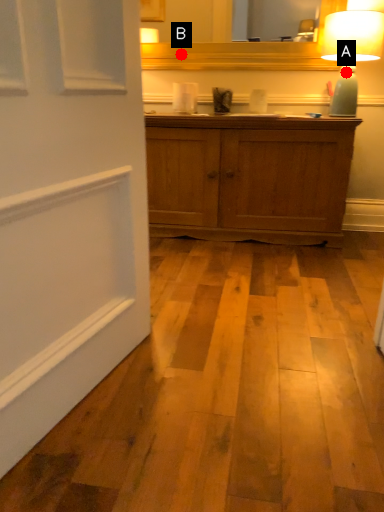
Question: Two points are circled on the image, labeled by A and B beside each circle. Which point appears farthest from the camera in this image?

Choices:
 (A) A is further
 (B) B is further

Answer: (B)